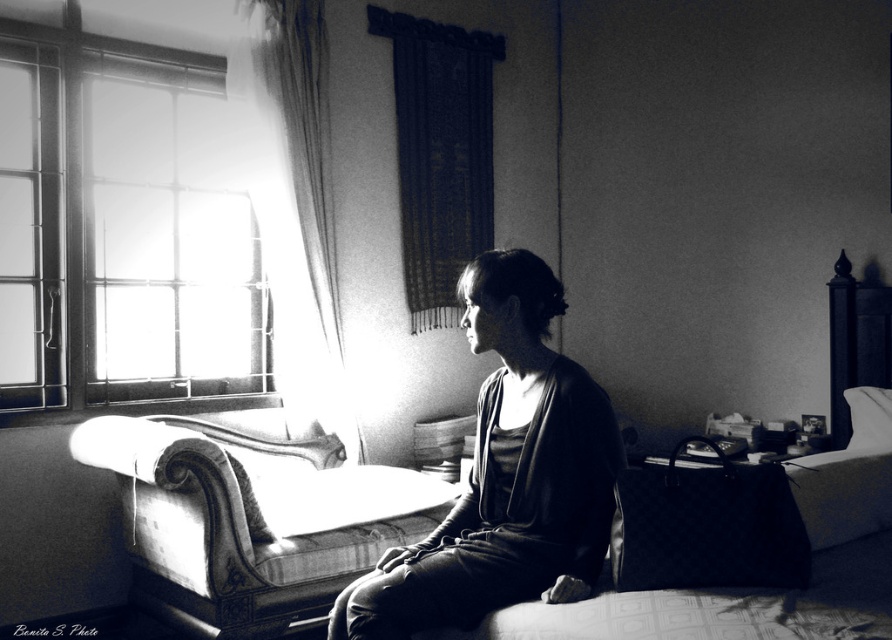
You are standing in the room and want to move from the glass pane window at upper left to the smooth fabric shirt at center. In which direction should you walk?

Since the glass pane window at upper left is to the left of the smooth fabric shirt at center, you should walk to the right to reach the smooth fabric shirt at center from the glass pane window at upper left.

You are standing in the room shown in the image. The glass pane window at upper left is located at coordinates. Can you determine its exact position based on the scene description?

The glass pane window at upper left is positioned at point (122, 224).

You are standing in the room shown in the image and want to open the glass pane window at upper left. If your arm reaches 2 meters, can you reach the window without moving closer?

The glass pane window at upper left is 3.05 meters away from the viewer. Since your arm can only reach 2 meters, you cannot reach the window without moving closer.